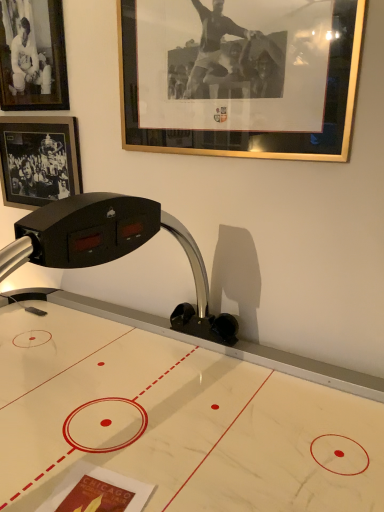
Question: From the image's perspective, is white glossy air hockey table at center under gold-framed picture at upper center, placed as the third picture frame when sorted from left to right?

Choices:
 (A) no
 (B) yes

Answer: (B)

Question: Is white glossy air hockey table at center behind gold-framed picture at upper center, placed as the third picture frame when sorted from left to right?

Choices:
 (A) no
 (B) yes

Answer: (A)

Question: Is white glossy air hockey table at center positioned before gold-framed picture at upper center, which ranks as the 1th picture frame in right-to-left order?

Choices:
 (A) no
 (B) yes

Answer: (B)

Question: From the image's perspective, would you say white glossy air hockey table at center is positioned over gold-framed picture at upper center, which ranks as the 1th picture frame in right-to-left order?

Choices:
 (A) yes
 (B) no

Answer: (B)

Question: Is white glossy air hockey table at center beside gold-framed picture at upper center, which ranks as the 1th picture frame in right-to-left order?

Choices:
 (A) yes
 (B) no

Answer: (B)

Question: From their relative heights in the image, would you say matte black photo frame at upper left, which appears as the 2th picture frame when viewed from the left, is taller or shorter than black matte picture frame at upper left, the first picture frame when ordered from left to right?

Choices:
 (A) tall
 (B) short

Answer: (A)

Question: Is matte black photo frame at upper left, positioned as the 2th picture frame in right-to-left order, wider or thinner than black matte picture frame at upper left, the first picture frame when ordered from left to right?

Choices:
 (A) wide
 (B) thin

Answer: (B)

Question: Based on their sizes in the image, would you say matte black photo frame at upper left, positioned as the 2th picture frame in right-to-left order, is bigger or smaller than black matte picture frame at upper left, arranged as the third picture frame when viewed from the right?

Choices:
 (A) big
 (B) small

Answer: (B)

Question: From the image's perspective, is matte black photo frame at upper left, positioned as the 2th picture frame in right-to-left order, positioned above or below black matte picture frame at upper left, arranged as the third picture frame when viewed from the right?

Choices:
 (A) above
 (B) below

Answer: (A)

Question: Choose the correct answer: Is black matte picture frame at upper left, the first picture frame when ordered from left to right, inside white glossy air hockey table at center or outside it?

Choices:
 (A) outside
 (B) inside

Answer: (B)

Question: Relative to white glossy air hockey table at center, is black matte picture frame at upper left, the first picture frame when ordered from left to right, in front or behind?

Choices:
 (A) front
 (B) behind

Answer: (B)

Question: From the image's perspective, is black matte picture frame at upper left, arranged as the third picture frame when viewed from the right, located above or below white glossy air hockey table at center?

Choices:
 (A) above
 (B) below

Answer: (A)

Question: In terms of width, does black matte picture frame at upper left, the first picture frame when ordered from left to right, look wider or thinner when compared to white glossy air hockey table at center?

Choices:
 (A) wide
 (B) thin

Answer: (B)

Question: Considering the positions of point (8, 26) and point (135, 450), is point (8, 26) closer or farther from the camera than point (135, 450)?

Choices:
 (A) closer
 (B) farther

Answer: (B)

Question: Looking at their shapes, would you say matte black photo frame at upper left, positioned as the 2th picture frame in right-to-left order, is wider or thinner than white glossy air hockey table at center?

Choices:
 (A) thin
 (B) wide

Answer: (A)